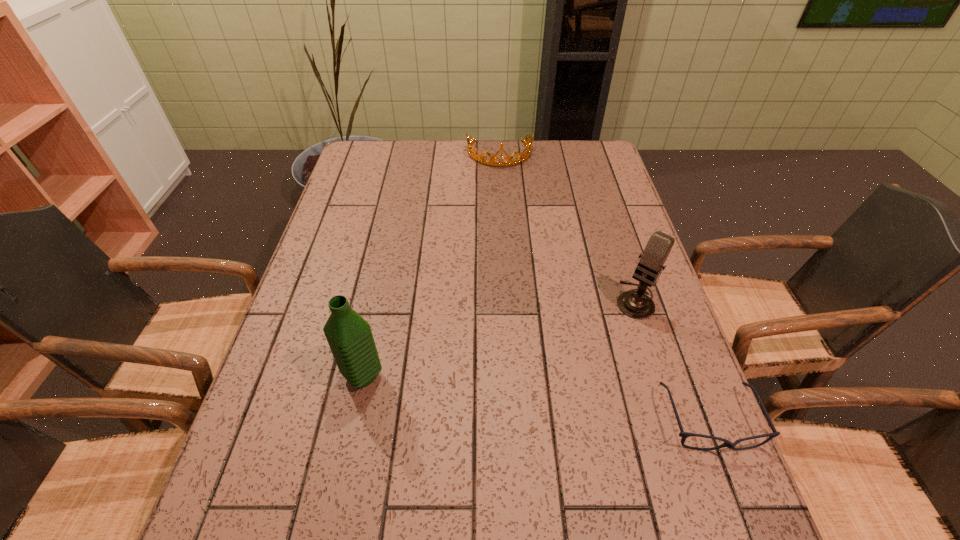
The height and width of the screenshot is (540, 960). I want to click on water bottle, so click(350, 338).

Image resolution: width=960 pixels, height=540 pixels. I want to click on the shortest object, so click(x=684, y=435).

You are a GUI agent. You are given a task and a screenshot of the screen. Output one action in this format:
    pyautogui.click(x=<x>, y=<y>)
    Task: Click on the tiara
    Image resolution: width=960 pixels, height=540 pixels.
    Given the screenshot: What is the action you would take?
    pyautogui.click(x=519, y=158)

You are a GUI agent. You are given a task and a screenshot of the screen. Output one action in this format:
    pyautogui.click(x=<x>, y=<y>)
    Task: Click on the farthest object
    The image size is (960, 540).
    Given the screenshot: What is the action you would take?
    pyautogui.click(x=519, y=158)

This screenshot has height=540, width=960. Identify the location of microphone. (636, 304).

Locate an element on the screen. The width and height of the screenshot is (960, 540). vacant region located on the right of the water bottle is located at coordinates (453, 375).

The width and height of the screenshot is (960, 540). Identify the location of vacant area situated on the front-facing side of the farthest object. (506, 231).

Where is `vacant area located 0.290m on the front-facing side of the farthest object`? The width and height of the screenshot is (960, 540). vacant area located 0.290m on the front-facing side of the farthest object is located at coordinates (506, 222).

Where is `free space located 0.050m on the front-facing side of the farthest object`? free space located 0.050m on the front-facing side of the farthest object is located at coordinates (502, 177).

This screenshot has height=540, width=960. I want to click on free location located 0.250m on the front-facing side of the third nearest object, so click(569, 383).